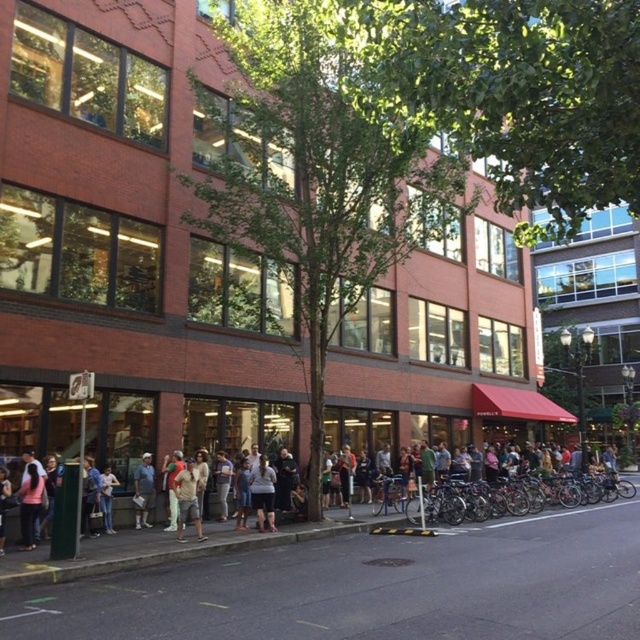
You are a delivery person with a cart that is 3 meters wide. You need to move from the black asphalt pavement at lower center to the pink fabric shirt at lower left. Is there enough space for your cart to pass between them?

The distance between the black asphalt pavement at lower center and the pink fabric shirt at lower left is 5.06 meters. Since the cart is 3 meters wide, there is sufficient space for the cart to pass between them.

You are standing on the sidewalk in front of the building and want to walk to the entrance. Which object should you step over first, the black asphalt pavement at lower center or the pink fabric shirt at lower left?

The black asphalt pavement at lower center is in front of the pink fabric shirt at lower left, so you should step over the black asphalt pavement at lower center first before reaching the pink fabric shirt at lower left.